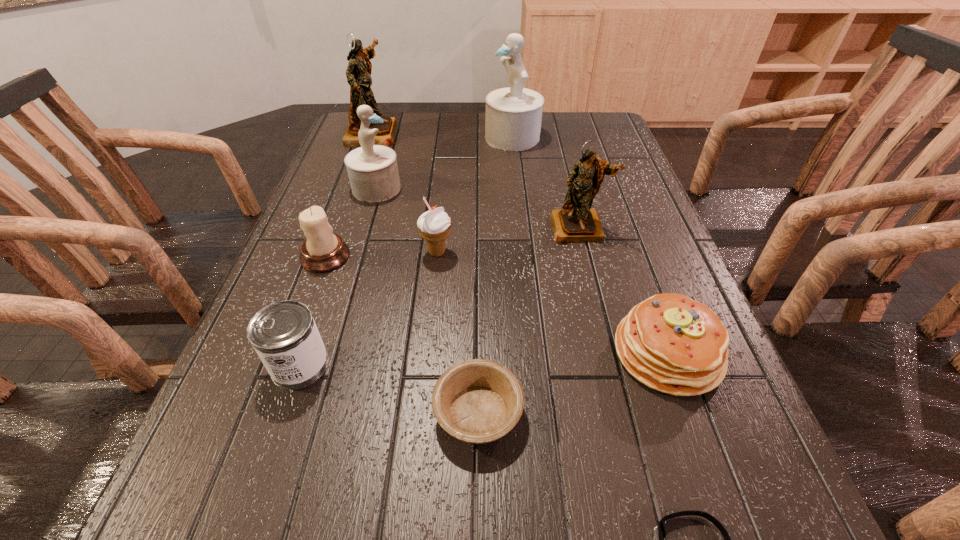
This screenshot has height=540, width=960. Find the location of `vacant space at the near edge of the desktop`. vacant space at the near edge of the desktop is located at coordinates click(x=539, y=539).

Identify the location of blank area at the right edge. (633, 187).

You are a GUI agent. You are given a task and a screenshot of the screen. Output one action in this format:
    pyautogui.click(x=<x>, y=<y>)
    Task: Click on the vacant space at the far right corner
    The height and width of the screenshot is (540, 960).
    Given the screenshot: What is the action you would take?
    pyautogui.click(x=564, y=112)

Locate an element on the screen. Image resolution: width=960 pixels, height=540 pixels. vacant area between the smaller gold figurine and the white candle holder is located at coordinates coord(452,242).

In order to click on empty space between the candle holder and the left gold figurine in this screenshot , I will do `click(348, 195)`.

The height and width of the screenshot is (540, 960). I want to click on free spot between the smaller gold figurine and the farther white figurine, so click(546, 183).

This screenshot has height=540, width=960. Identify the location of vacant region between the third shortest object and the right white figurine. 590,245.

This screenshot has height=540, width=960. Find the location of `free space between the left gold figurine and the icecream`. free space between the left gold figurine and the icecream is located at coordinates (404, 193).

Identify the location of vacant region between the white icecream and the smaller gold figurine. The image size is (960, 540). (508, 240).

Point out which object is positioned as the seventh nearest to the white icecream. Please provide its 2D coordinates. Your answer should be formatted as a tuple, i.e. [(x, y)], where the tuple contains the x and y coordinates of a point satisfying the conditions above.

[(513, 117)]